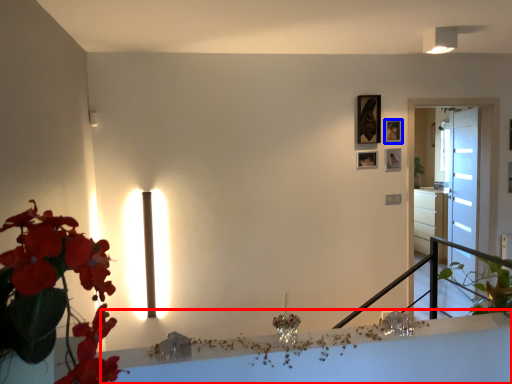
Question: Which point is closer to the camera, table (highlighted by a red box) or picture frame (highlighted by a blue box)?

Choices:
 (A) table
 (B) picture frame

Answer: (A)